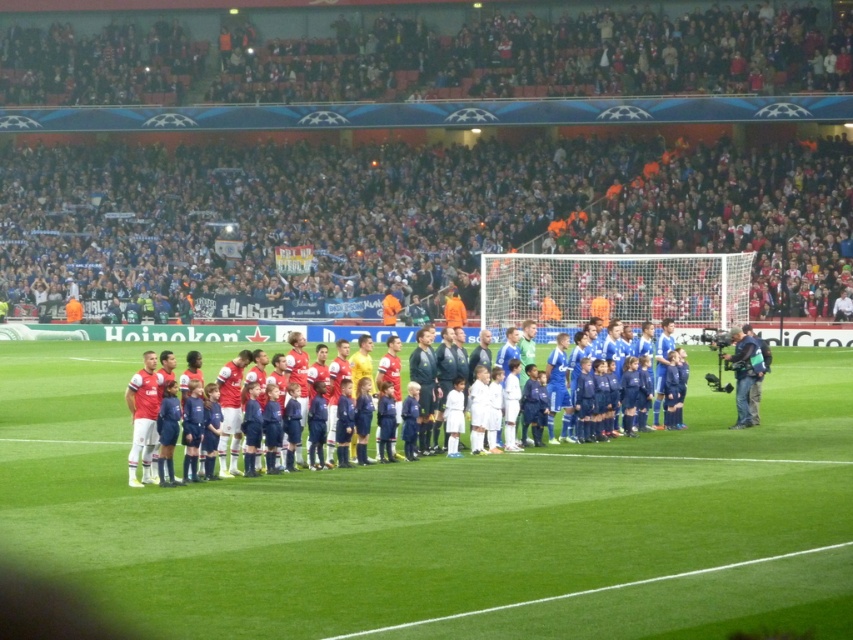
Question: Which of the following is the farthest from the observer?

Choices:
 (A) blue fabric jersey at center
 (B) green grass football field at center

Answer: (A)

Question: Does green grass football field at center have a larger size compared to blue fabric jersey at center?

Choices:
 (A) no
 (B) yes

Answer: (B)

Question: Which of the following is the closest to the observer?

Choices:
 (A) (801, 355)
 (B) (738, 355)
 (C) (451, 454)

Answer: (C)

Question: Is black fabric camera at right to the right of blue fabric jersey at center from the viewer's perspective?

Choices:
 (A) no
 (B) yes

Answer: (B)

Question: Which of the following is the farthest from the observer?

Choices:
 (A) (751, 417)
 (B) (421, 396)

Answer: (A)

Question: Is black fabric camera at right above blue fabric jersey at center?

Choices:
 (A) no
 (B) yes

Answer: (A)